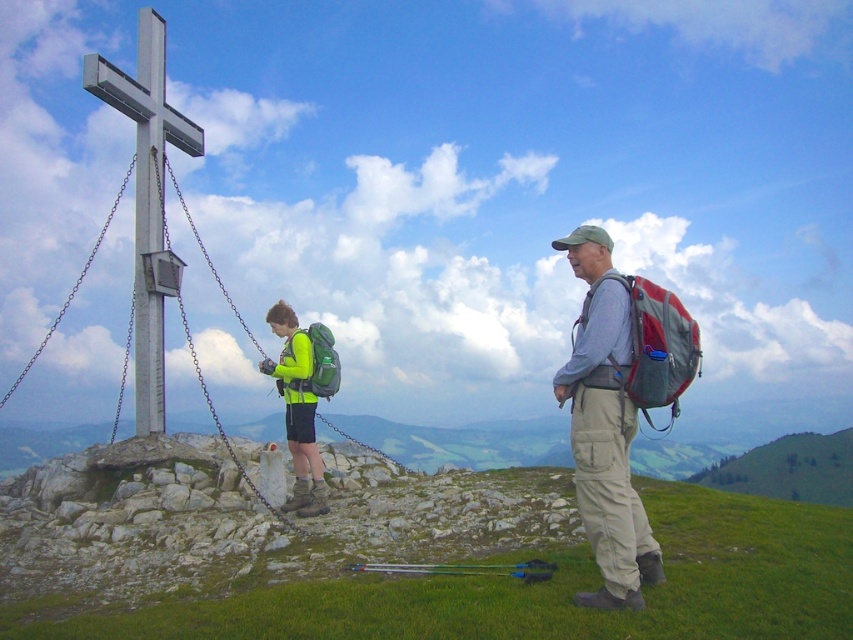
Question: Can you confirm if metallic silver cross at upper left is positioned below green matte backpack at center?

Choices:
 (A) yes
 (B) no

Answer: (B)

Question: Estimate the real-world distances between objects in this image. Which object is closer to the matte gray backpack at right?

Choices:
 (A) green matte backpack at center
 (B) metallic silver cross at upper left

Answer: (A)

Question: Does matte gray backpack at right have a lesser width compared to green matte backpack at center?

Choices:
 (A) yes
 (B) no

Answer: (A)

Question: Which of the following is the farthest from the observer?

Choices:
 (A) metallic silver cross at upper left
 (B) matte gray backpack at right
 (C) green matte backpack at center

Answer: (A)

Question: Which of these objects is positioned farthest from the green matte backpack at center?

Choices:
 (A) matte gray backpack at right
 (B) metallic silver cross at upper left

Answer: (A)

Question: Does matte gray backpack at right have a larger size compared to green matte backpack at center?

Choices:
 (A) yes
 (B) no

Answer: (A)